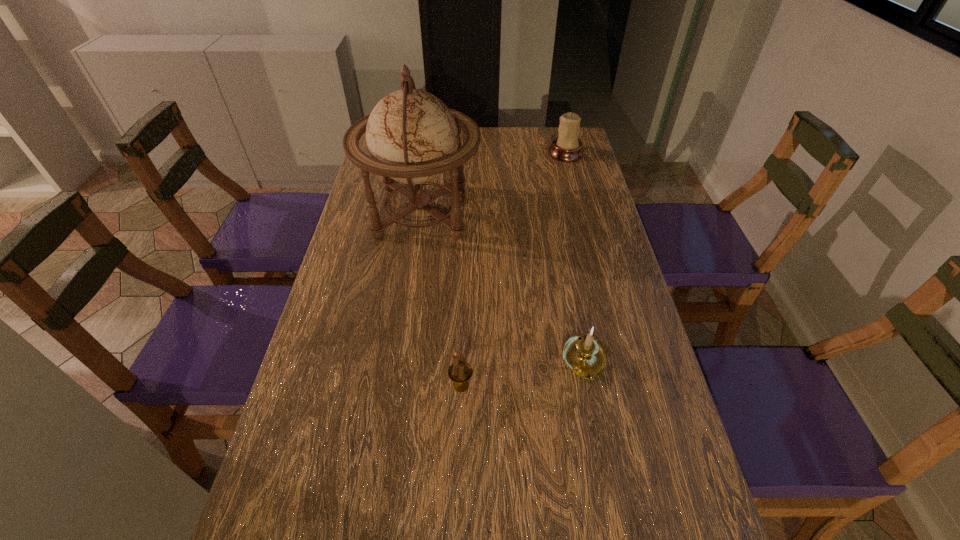
The height and width of the screenshot is (540, 960). What are the coordinates of `object that is positioned at the far right corner` in the screenshot? It's located at (567, 147).

The image size is (960, 540). Identify the location of blank space at the far edge of the desktop. (500, 151).

What are the coordinates of `free region at the left edge of the desktop` in the screenshot? It's located at [x=348, y=347].

This screenshot has height=540, width=960. What are the coordinates of `free space at the right edge of the desktop` in the screenshot? It's located at (616, 510).

In order to click on free space between the tallest object and the leftmost candle holder in this screenshot , I will do `click(442, 299)`.

The image size is (960, 540). Find the location of `vacant space that is in between the tallest object and the farthest candle holder`. vacant space that is in between the tallest object and the farthest candle holder is located at coordinates (493, 183).

The image size is (960, 540). Find the location of `vacant space that's between the farthest object and the leftmost candle holder`. vacant space that's between the farthest object and the leftmost candle holder is located at coordinates (514, 269).

Find the location of a particular element. This screenshot has height=540, width=960. free area in between the tallest candle holder and the globe is located at coordinates pos(493,183).

The image size is (960, 540). I want to click on empty location between the farthest object and the second farthest object, so click(493, 183).

The image size is (960, 540). I want to click on blank region between the leftmost candle holder and the tallest candle holder, so click(514, 269).